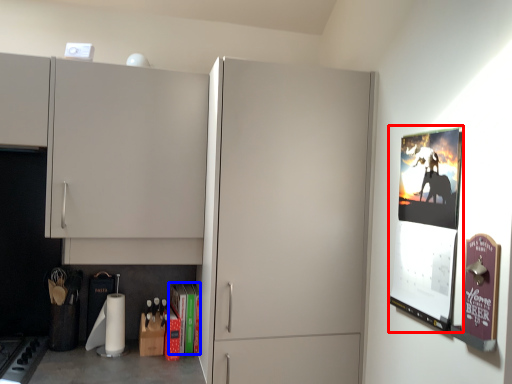
Question: Which object is closer to the camera taking this photo, poster page (highlighted by a red box) or magazine (highlighted by a blue box)?

Choices:
 (A) poster page
 (B) magazine

Answer: (A)